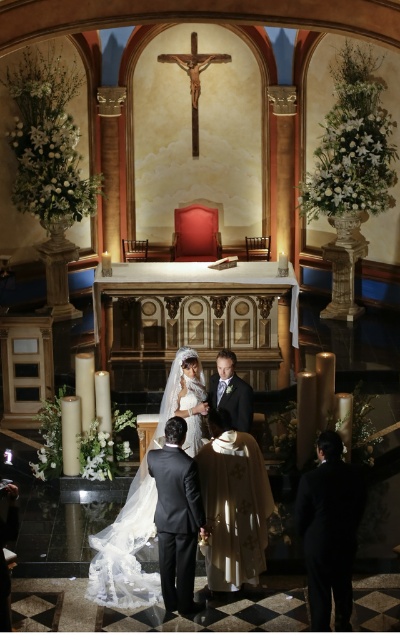
You are a photographer standing at the back of the church. You need to capture a photo of the black suit at lower right and the satin white dress at center without any obstruction. Given that your camera has a focal length of 50mm, which allows for a clear shot up to 8 feet away, can you take the photo from your current position?

The distance between the black suit at lower right and the satin white dress at center is 7.55 feet, which is within the camera focal length range of 50mm. Therefore, you can take the photo without any obstruction.